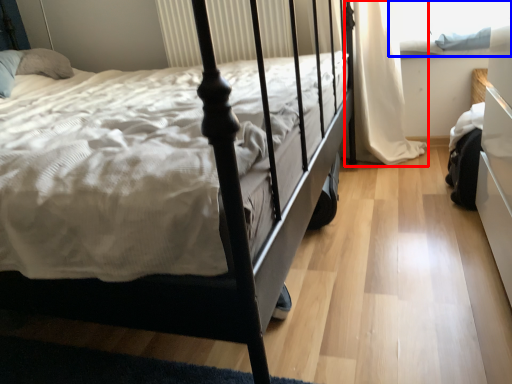
Question: Which object appears closest to the camera in this image, curtain (highlighted by a red box) or window screen (highlighted by a blue box)?

Choices:
 (A) curtain
 (B) window screen

Answer: (A)